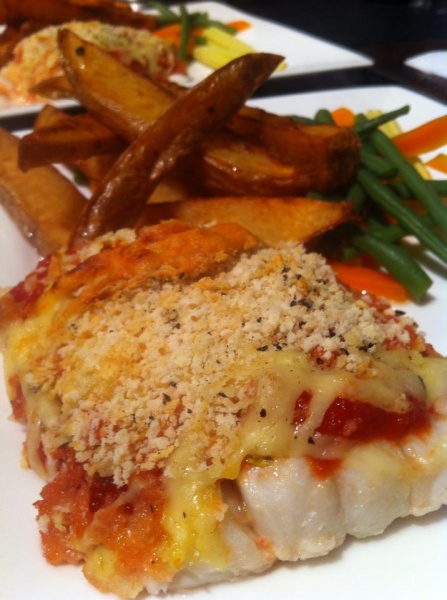
Where is `plate`? This screenshot has height=600, width=447. plate is located at coordinates (391, 570).